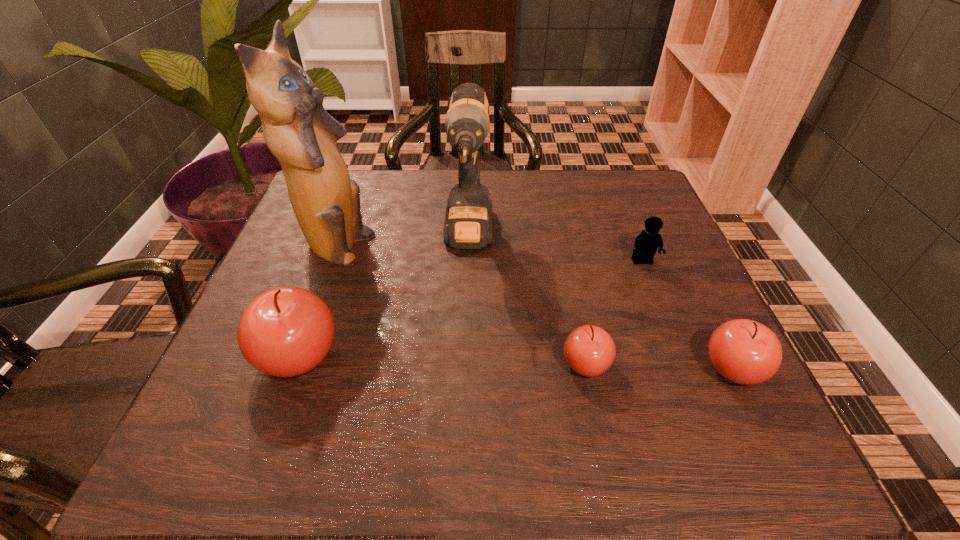
Find the location of a particular element. This screenshot has width=960, height=540. the leftmost apple is located at coordinates (287, 331).

This screenshot has height=540, width=960. What are the coordinates of `the third tallest object` in the screenshot? It's located at (287, 331).

Locate an element on the screen. the shortest apple is located at coordinates (589, 350).

The image size is (960, 540). I want to click on the second apple from left to right, so click(x=589, y=350).

Image resolution: width=960 pixels, height=540 pixels. I want to click on the second shortest apple, so click(x=743, y=351).

I want to click on the second tallest object, so click(x=468, y=221).

Where is `the fourth object from right to left`? This screenshot has width=960, height=540. the fourth object from right to left is located at coordinates (468, 221).

Locate an element on the screen. This screenshot has height=540, width=960. Lego is located at coordinates (646, 244).

The width and height of the screenshot is (960, 540). Identify the location of the tallest object. (298, 131).

At what (x,y) coordinates should I click in order to perform the action: click on free space located 0.130m on the right of the tallest apple. Please return your answer as a coordinate pair (x, y). The width and height of the screenshot is (960, 540). Looking at the image, I should click on (412, 356).